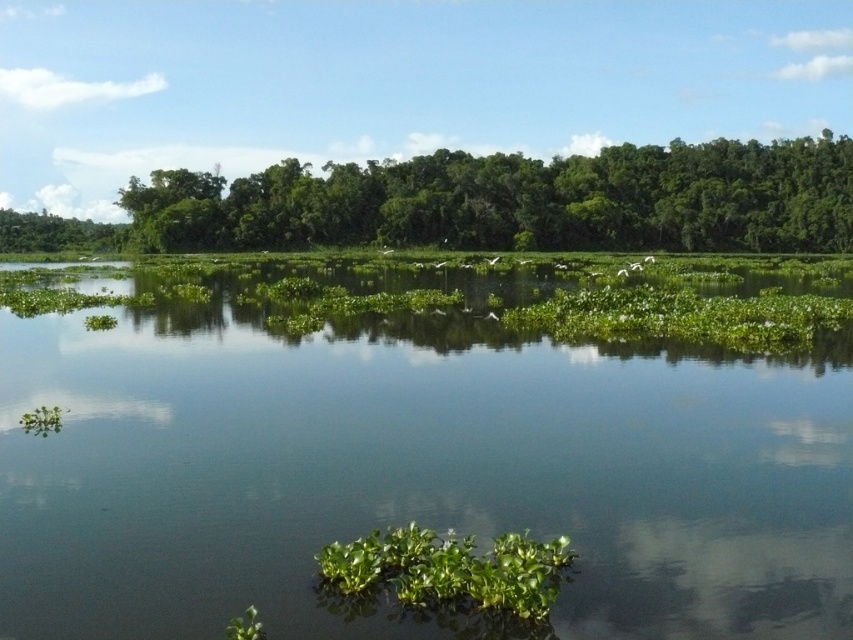
Question: Considering the real-world distances, which object is farthest from the green leafy trees at upper center?

Choices:
 (A) green leafy tree at upper left
 (B) green leafy vegetation at center
 (C) green leafy plant at center

Answer: (C)

Question: Can you confirm if green leafy trees at upper center is positioned to the right of green leafy plant at center?

Choices:
 (A) yes
 (B) no

Answer: (A)

Question: Which object appears closest to the camera in this image?

Choices:
 (A) green leafy trees at upper center
 (B) green leafy plant at center
 (C) green leafy tree at upper left

Answer: (B)

Question: Which point is farther to the camera?

Choices:
 (A) (316, 218)
 (B) (22, 221)
 (C) (427, 547)
 (D) (796, 506)

Answer: (B)

Question: Is green leafy trees at upper center above green leafy plant at center?

Choices:
 (A) no
 (B) yes

Answer: (B)

Question: Considering the relative positions of green leafy trees at upper center and green leafy tree at upper left in the image provided, where is green leafy trees at upper center located with respect to green leafy tree at upper left?

Choices:
 (A) above
 (B) below

Answer: (B)